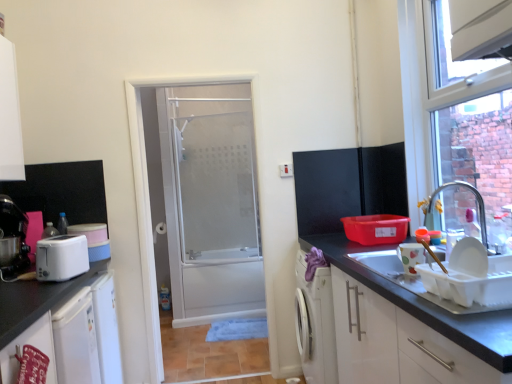
Question: Is white frosted glass door at center inside the boundaries of white glossy cabinet at lower right, which is counted as the 3th cabinetry, starting from the left, or outside?

Choices:
 (A) outside
 (B) inside

Answer: (A)

Question: Relative to white glossy cabinet at lower right, marked as the first cabinetry in a right-to-left arrangement, is white frosted glass door at center in front or behind?

Choices:
 (A) front
 (B) behind

Answer: (B)

Question: Which object is positioned farthest from the matte black coffee machine at left?

Choices:
 (A) white glossy cabinet at lower right, marked as the first cabinetry in a right-to-left arrangement
 (B) matte black cabinet at upper right
 (C) white plastic toaster at left, acting as the second appliance starting from the right
 (D) matte ceramic cup at right, which is counted as the second appliance, starting from the back
 (E) clear glass faucet at upper right

Answer: (E)

Question: Estimate the real-world distances between objects in this image. Which object is farther from the white matte refrigerator at lower left, placed as the 1th cabinetry when sorted from left to right?

Choices:
 (A) matte ceramic cup at right, which is counted as the second appliance, starting from the back
 (B) white plastic toaster at left, which ranks as the 1th appliance in left-to-right order
 (C) frosted glass shower door at center
 (D) clear glass faucet at upper right
 (E) matte black cabinet at upper right

Answer: (D)